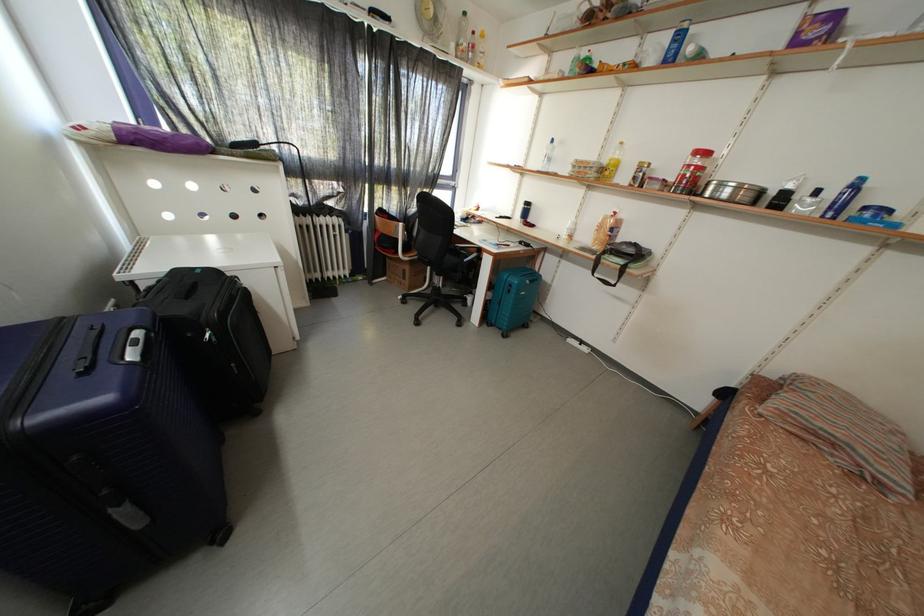
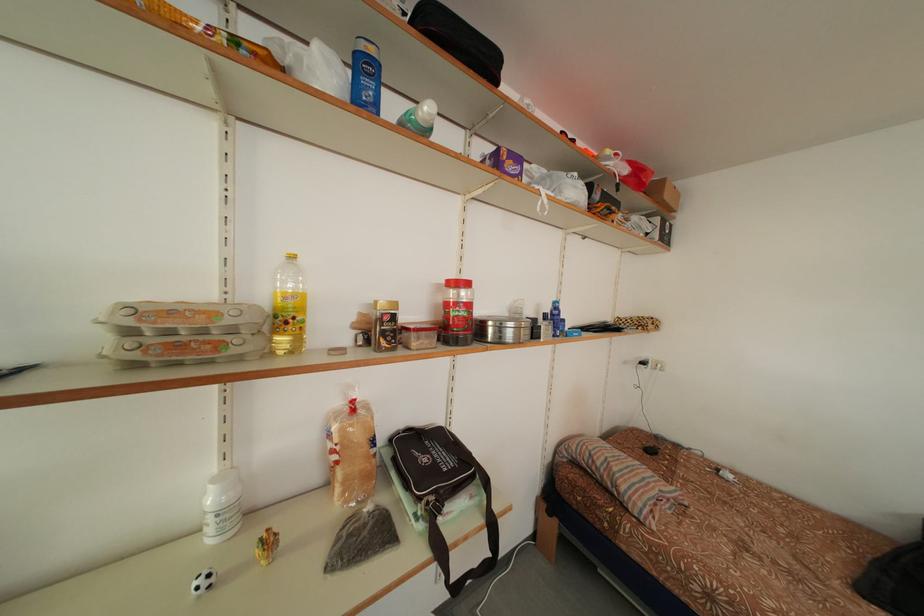
Where in the second image is the point corresponding to (623,217) from the first image?

(360, 407)